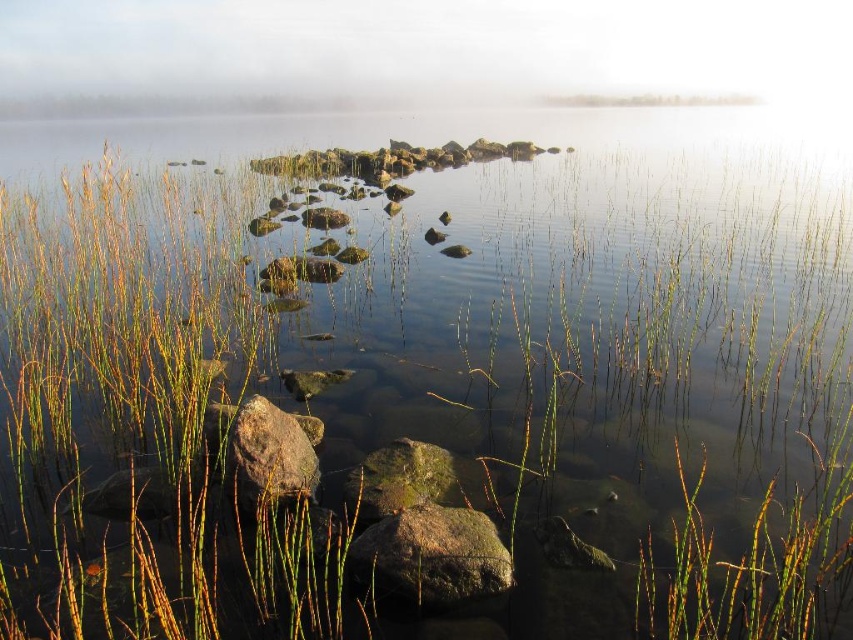
You are standing at the lakeside and want to place a small decorative statue on the ground. The statue requires a stable surface. Which object from the scene, the rusty metallic boulder at lower left or the green mossy rock at center, would provide a more stable base for the statue?

The rusty metallic boulder at lower left is located above the green mossy rock at center, so it is higher and more elevated. However, stability depends on the surface area and weight distribution. Since the description mentions the mossy rock is at the center and submerged partially, it might be more stable due to being anchored in water. But the metallic boulder at lower left, being above, might have a firmer ground contact. Without specific weight or surface details, it is hard to determine. However, the

You are an environmental inspector assessing the stability of the lakeside area. You notice the rusty metallic boulder at lower left and the green mossy rock at center. Which of these two objects has a smaller width, and how might this affect their potential impact on the surrounding ecosystem?

The rusty metallic boulder at lower left has a smaller width than the green mossy rock at center. This smaller size might mean it has less surface area to support plant or animal life, potentially making it less impactful on the ecosystem compared to the larger rock.

You are a landscape architect designing a pathway through this lakeside area. The pathway must be wide enough to accommodate a standard wheelchair, which requires a minimum width of 1.2 meters. Given the green matte grass at center and the rusty metallic boulder at lower left, which object should you use as a reference for the pathway width, and why?

The green matte grass at center should be used as the reference because its width surpasses that of the rusty metallic boulder at lower left, ensuring the pathway meets the required 1.2 meters width.